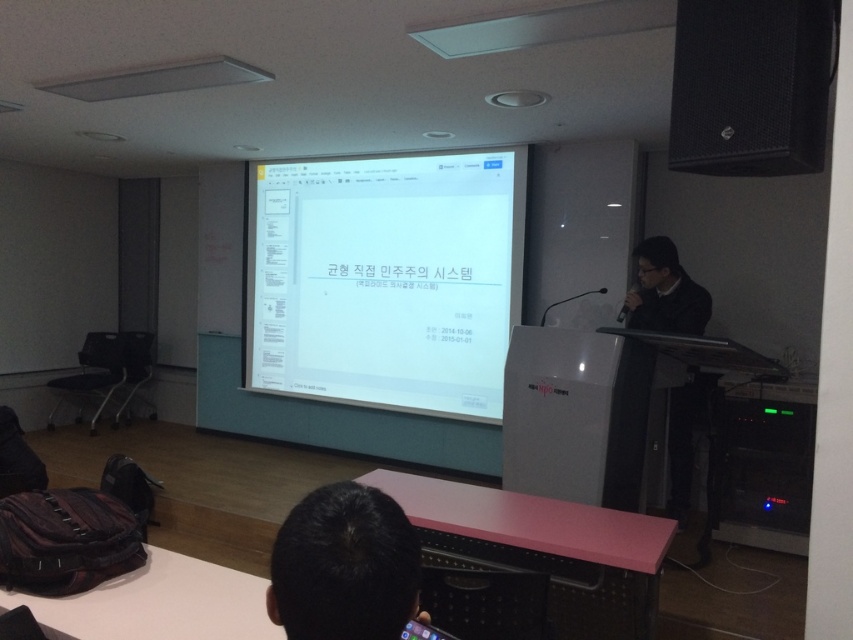
Is the position of white paper at center less distant than that of black hair at lower center?

No, white paper at center is behind black hair at lower center.

In the scene shown: Is white paper at center smaller than black hair at lower center?

Incorrect, white paper at center is not smaller in size than black hair at lower center.

Does point (422, 189) come in front of point (302, 588)?

No, it is not.

Locate an element on the screen. white paper at center is located at coordinates (386, 280).

The height and width of the screenshot is (640, 853). In order to click on black matte speaker at upper right in this screenshot , I will do `click(751, 84)`.

Measure the distance between point (773, 163) and camera.

Point (773, 163) is 6.49 feet from camera.

Image resolution: width=853 pixels, height=640 pixels. Find the location of `black matte speaker at upper right`. black matte speaker at upper right is located at coordinates click(x=751, y=84).

Is white paper at center positioned in front of black matte speaker at upper right?

No, it is not.

Which is behind, point (497, 209) or point (785, 156)?

Positioned behind is point (497, 209).

This screenshot has height=640, width=853. I want to click on white paper at center, so click(386, 280).